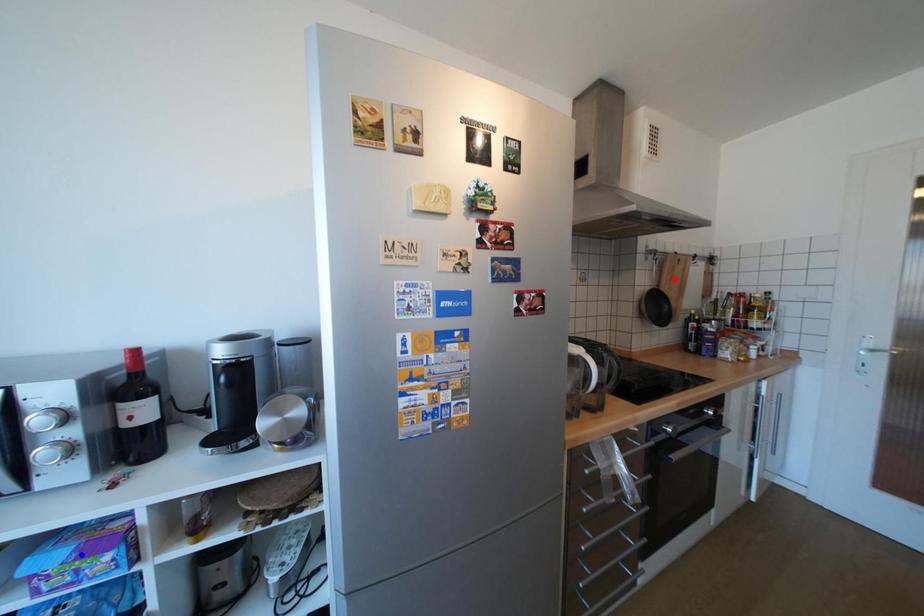
Question: Which of the two points in the image is closer to the camera?

Choices:
 (A) Blue point is closer.
 (B) Red point is closer.

Answer: (A)